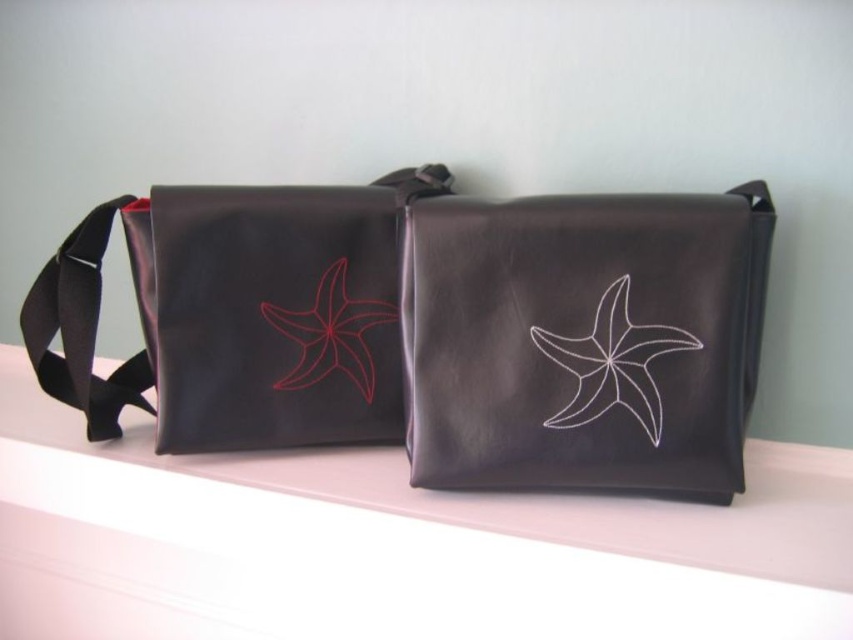
You are standing in front of two bags against a wall. You see a point at point (84, 253) and another at point (746, 506). Which point is closer to you?

Point (84, 253) is closer to you than point (746, 506).

You are standing in front of two bags against a light blue wall. You see the black fabric strap at left and the white starfish design on the right bag. Which strap is closer to you?

The black fabric strap at left is closer to you because it is only 36.30 inches away, while the white starfish design on the right bag is farther away.

You are standing in front of two bags displayed against a light blue wall. You see a matte black bag at center and a white matte star at center. Which bag is positioned to the left?

The matte black bag at center is to the left of the white matte star at center.